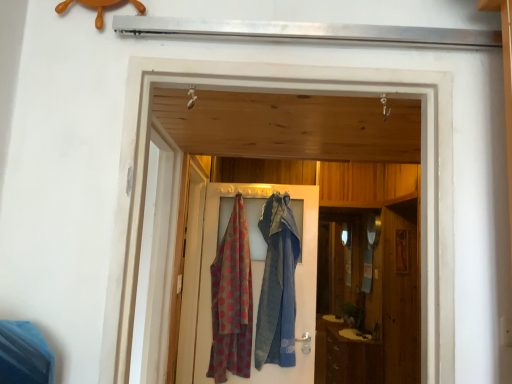
Question: Is polka dot fabric at center a part of brown wood cabinet at lower right?

Choices:
 (A) yes
 (B) no

Answer: (B)

Question: From the image's perspective, is brown wood cabinet at lower right on polka dot fabric at center?

Choices:
 (A) no
 (B) yes

Answer: (A)

Question: From the image's perspective, is brown wood cabinet at lower right located beneath polka dot fabric at center?

Choices:
 (A) yes
 (B) no

Answer: (A)

Question: Is brown wood cabinet at lower right smaller than polka dot fabric at center?

Choices:
 (A) yes
 (B) no

Answer: (B)

Question: Does brown wood cabinet at lower right have a greater width compared to polka dot fabric at center?

Choices:
 (A) no
 (B) yes

Answer: (B)

Question: From the image's perspective, is white glossy screen door at upper center, which appears as the second screen door when viewed from the back, located above or below polka dot fabric at center?

Choices:
 (A) below
 (B) above

Answer: (B)

Question: Is white glossy screen door at upper center, which appears as the second screen door when viewed from the back, inside or outside of polka dot fabric at center?

Choices:
 (A) inside
 (B) outside

Answer: (B)

Question: In the image, is white glossy screen door at upper center, positioned as the 1th screen door in front-to-back order, on the left side or the right side of polka dot fabric at center?

Choices:
 (A) left
 (B) right

Answer: (A)

Question: Considering their positions, is white glossy screen door at upper center, positioned as the 1th screen door in front-to-back order, located in front of or behind polka dot fabric at center?

Choices:
 (A) front
 (B) behind

Answer: (A)

Question: From a real-world perspective, is polka dot fabric at center above or below brown wood cabinet at lower right?

Choices:
 (A) above
 (B) below

Answer: (A)

Question: Does point (311, 370) appear closer or farther from the camera than point (318, 350)?

Choices:
 (A) closer
 (B) farther

Answer: (A)

Question: In the image, is polka dot fabric at center on the left side or the right side of brown wood cabinet at lower right?

Choices:
 (A) right
 (B) left

Answer: (B)

Question: From the image's perspective, is polka dot fabric at center located above or below brown wood cabinet at lower right?

Choices:
 (A) below
 (B) above

Answer: (B)

Question: From a real-world perspective, relative to polka dot fabric at center, is polka dot fabric at center vertically above or below?

Choices:
 (A) above
 (B) below

Answer: (A)

Question: Is polka dot fabric at center wider or thinner than polka dot fabric at center?

Choices:
 (A) thin
 (B) wide

Answer: (A)